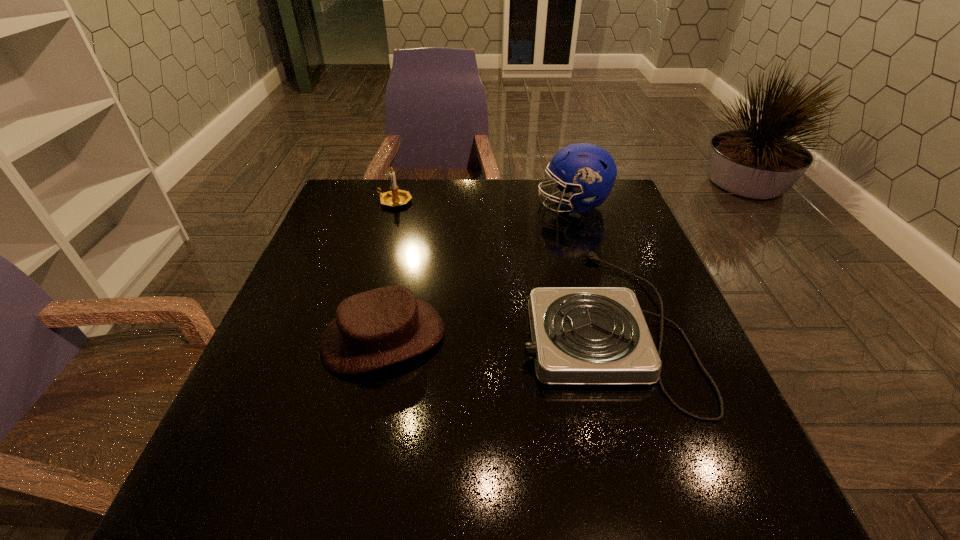
Where is `free point between the third shortest object and the third tallest object`? free point between the third shortest object and the third tallest object is located at coordinates (389, 269).

Find the location of a particular element. This screenshot has height=540, width=960. free space between the shortest object and the second shortest object is located at coordinates (492, 330).

This screenshot has height=540, width=960. I want to click on empty space that is in between the hat and the hotplate, so click(x=492, y=330).

This screenshot has height=540, width=960. What are the coordinates of `vacant area between the second shortest object and the football helmet` in the screenshot? It's located at (478, 271).

At what (x,y) coordinates should I click in order to perform the action: click on blank region between the candle holder and the tallest object. Please return your answer as a coordinate pair (x, y). The width and height of the screenshot is (960, 540). Looking at the image, I should click on (484, 203).

Locate an element on the screen. The width and height of the screenshot is (960, 540). object that is the third nearest to the football helmet is located at coordinates (380, 327).

I want to click on object identified as the closest to the hat, so click(x=580, y=335).

The height and width of the screenshot is (540, 960). In order to click on blank area in the image that satisfies the following two spatial constraints: 1. on the front-facing side of the tallest object; 2. on the front side of the second shortest object in this screenshot , I will do `click(612, 337)`.